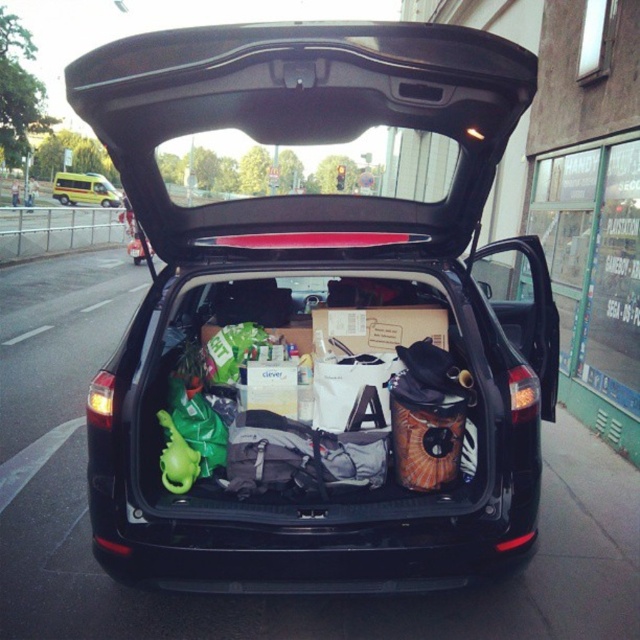
Question: Is black matte car trunk at center smaller than yellow metallic van at center?

Choices:
 (A) yes
 (B) no

Answer: (B)

Question: Does black matte car trunk at center have a larger size compared to yellow metallic van at center?

Choices:
 (A) yes
 (B) no

Answer: (A)

Question: In this image, where is black matte car trunk at center located relative to yellow metallic van at center?

Choices:
 (A) left
 (B) right

Answer: (B)